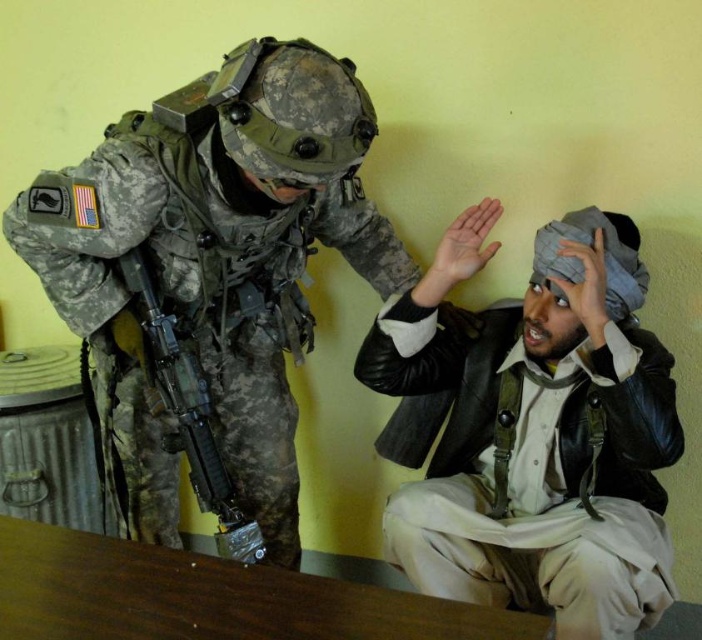
Does leather jacket at center have a smaller size compared to brown wooden table at lower left?

Incorrect, leather jacket at center is not smaller in size than brown wooden table at lower left.

Identify the location of leather jacket at center. (536, 432).

Where is `leather jacket at center`? This screenshot has width=702, height=640. leather jacket at center is located at coordinates (536, 432).

Image resolution: width=702 pixels, height=640 pixels. I want to click on leather jacket at center, so click(x=536, y=432).

The height and width of the screenshot is (640, 702). Describe the element at coordinates (536, 432) in the screenshot. I see `leather jacket at center` at that location.

Locate an element on the screen. The height and width of the screenshot is (640, 702). leather jacket at center is located at coordinates (536, 432).

Does camouflage fabric uniform at left lie in front of matte black rifle at left?

Yes, it is.

Is camouflage fabric uniform at left further to the viewer compared to matte black rifle at left?

No, camouflage fabric uniform at left is in front of matte black rifle at left.

Locate an element on the screen. camouflage fabric uniform at left is located at coordinates (194, 308).